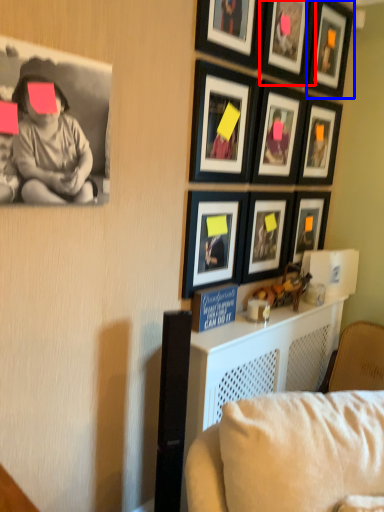
Question: Which object appears farthest to the camera in this image, picture frame (highlighted by a red box) or picture frame (highlighted by a blue box)?

Choices:
 (A) picture frame
 (B) picture frame

Answer: (B)